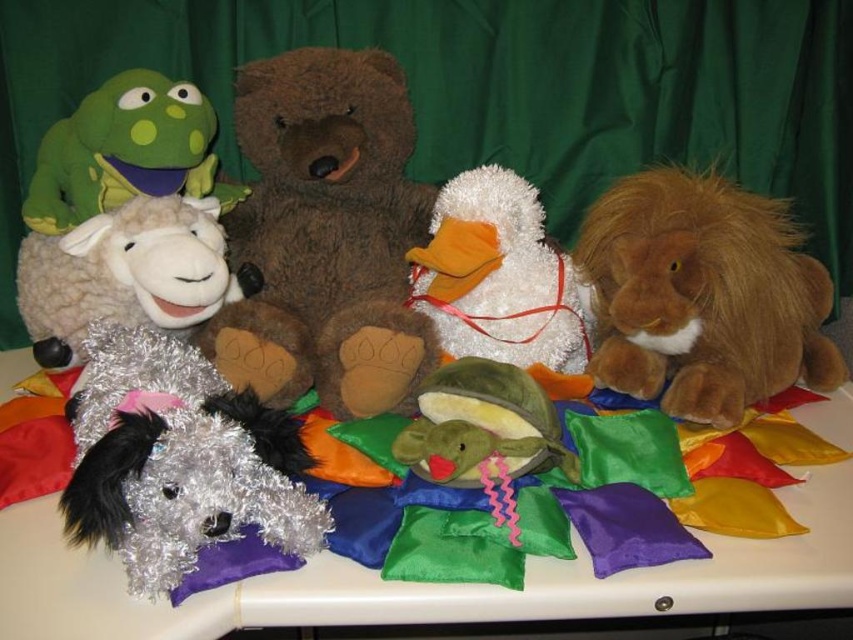
You are organizing a toy store shelf and need to arrange the brown plush lion at right and the green plush frog at upper left based on their sizes. According to the scene, which toy should be placed higher up if you want to put taller items on upper shelves?

The brown plush lion at right is taller than the green plush frog at upper left, so it should be placed higher up on the shelf.

You are organizing a childrens playroom and need to place a new toy between the brown plush lion at right and the green plush frog at upper left. Based on their positions, where should you place the new toy to ensure it is between them?

The new toy should be placed between the brown plush lion at right and the green plush frog at upper left, closer to the brown plush lion at right since it is in front of the green plush frog at upper left.